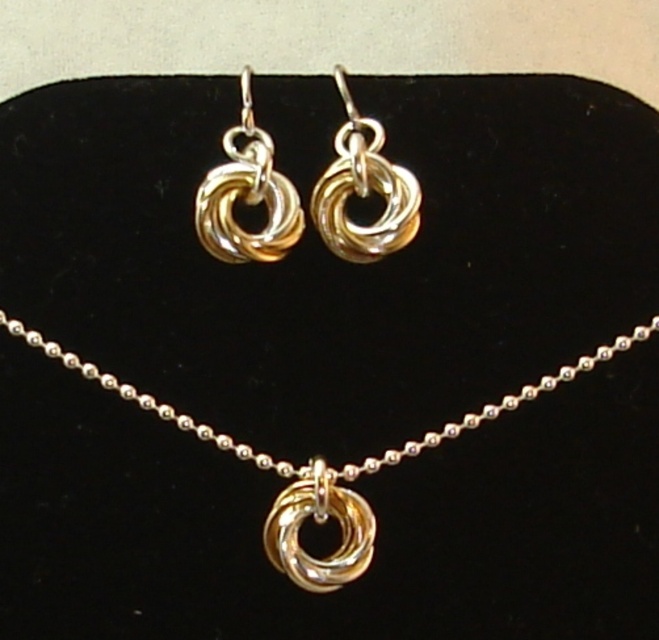
Between point (337, 179) and point (215, 250), which one is positioned in front?

Point (337, 179)

Who is lower down, gold shiny knot at upper center or gold shiny knot at upper left?

gold shiny knot at upper left is below.

Does point (343, 172) lie in front of point (248, 147)?

That is True.

This screenshot has height=640, width=659. What are the coordinates of `gold shiny knot at upper center` in the screenshot? It's located at (362, 189).